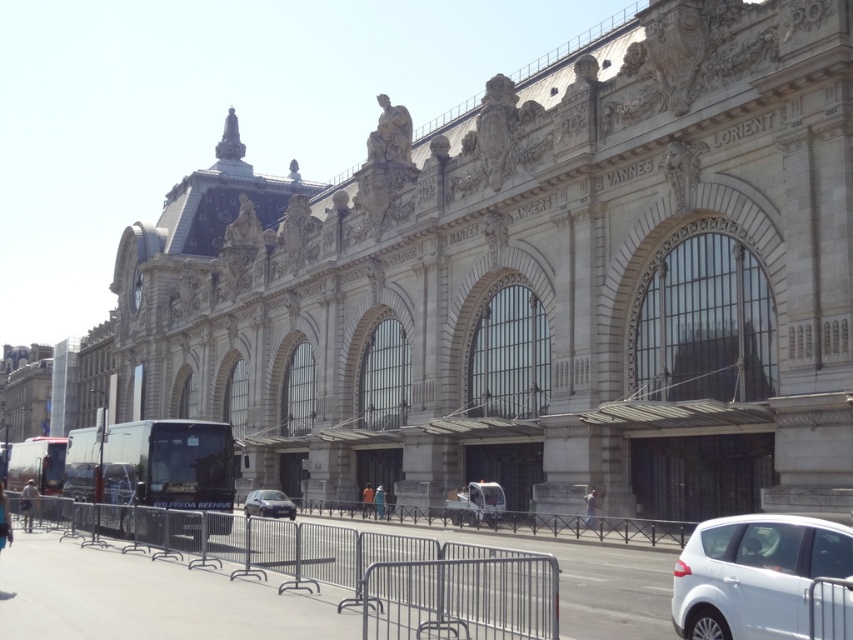
Between metallic silver bus at lower left and blue denim jeans at lower left, which one appears on the right side from the viewer's perspective?

blue denim jeans at lower left

At what (x,y) coordinates should I click in order to perform the action: click on metallic silver bus at lower left. Please return your answer as a coordinate pair (x, y). The image size is (853, 640). Looking at the image, I should click on (36, 465).

Who is higher up, metallic silver bus at lower left or blue fabric person at center?

blue fabric person at center is above.

Find the location of a particular element. The height and width of the screenshot is (640, 853). metallic silver bus at lower left is located at coordinates (36, 465).

The image size is (853, 640). What are the coordinates of `metallic silver bus at lower left` in the screenshot? It's located at (36, 465).

Between point (251, 500) and point (4, 508), which one is positioned in front?

Point (4, 508) is in front.

Who is more distant from viewer, (265, 506) or (0, 497)?

Positioned behind is point (265, 506).

Identify the location of shiny silver sedan at center. This screenshot has height=640, width=853. (268, 502).